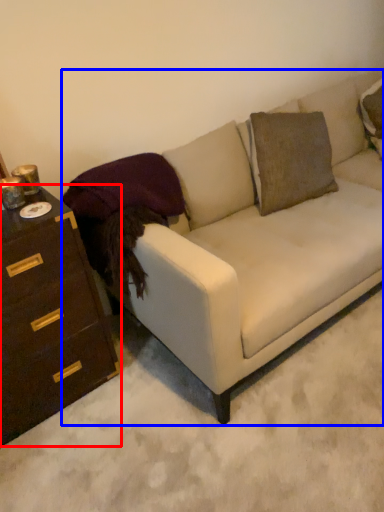
Question: Which object is closer to the camera taking this photo, chest of drawers (highlighted by a red box) or studio couch (highlighted by a blue box)?

Choices:
 (A) chest of drawers
 (B) studio couch

Answer: (B)